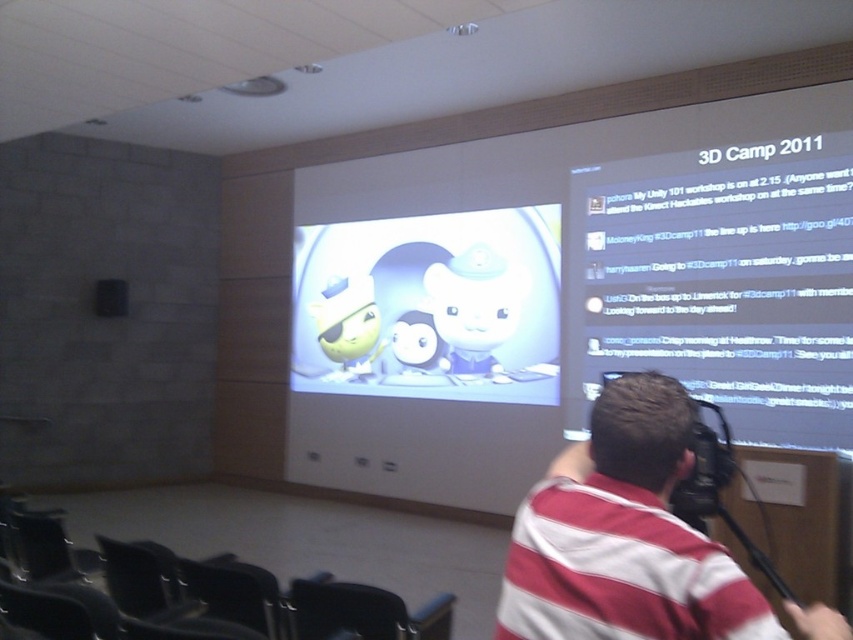
Consider the image. You are standing in the conference room and want to take a photo of the matte cartoon characters at center. If your camera has a maximum focus range of 5 meters, will you be able to capture a clear image of them?

The matte cartoon characters at center are 6.08 meters away from the camera, which exceeds the maximum focus range of 5 meters. Therefore, you won it capture a clear image of them.

You are attending a presentation and see the matte cartoon characters at center and the striped cotton shirt at center. Which object is positioned higher in the image?

The matte cartoon characters at center are positioned higher than the striped cotton shirt at center according to the description.